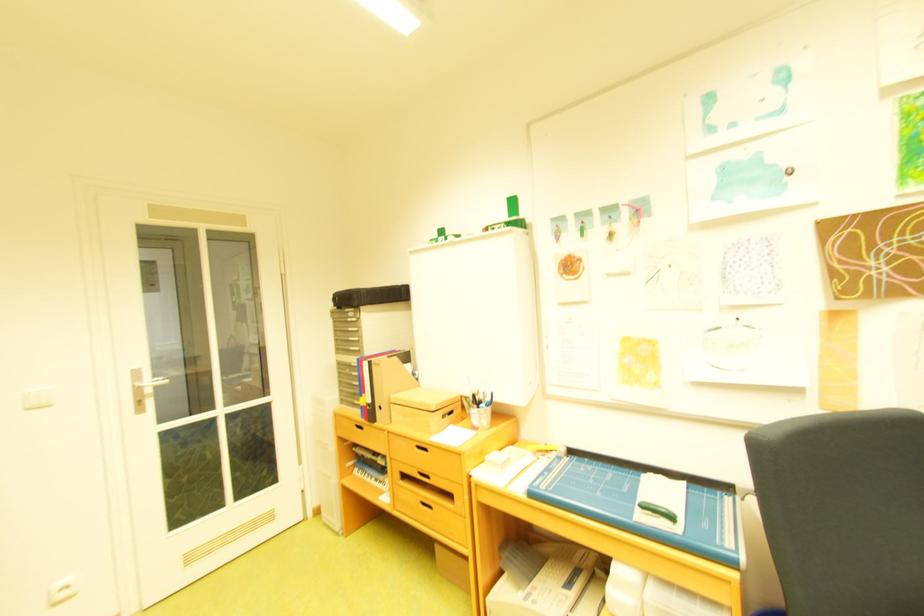
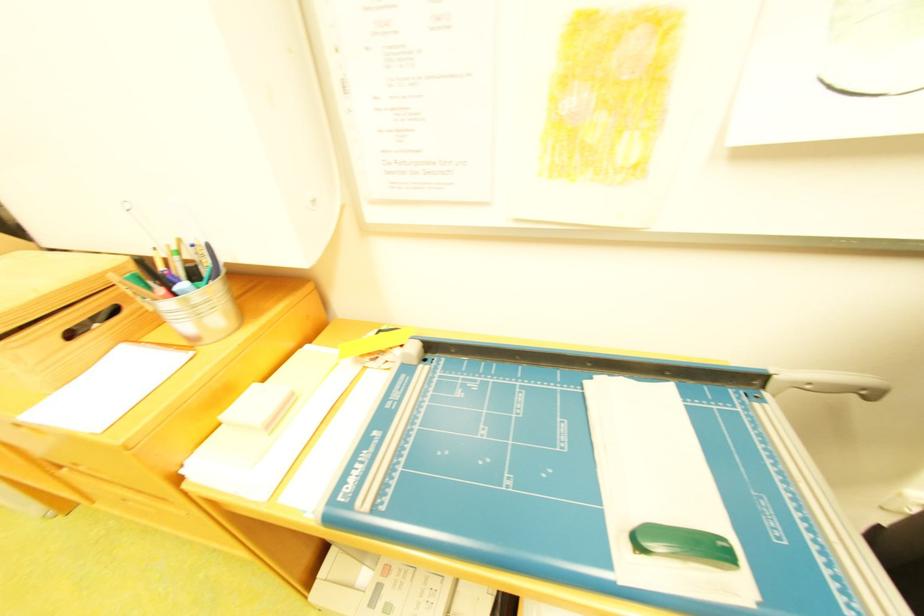
Based on the continuous images, in which direction is the camera rotating?

The rotation direction of the camera is right-down.